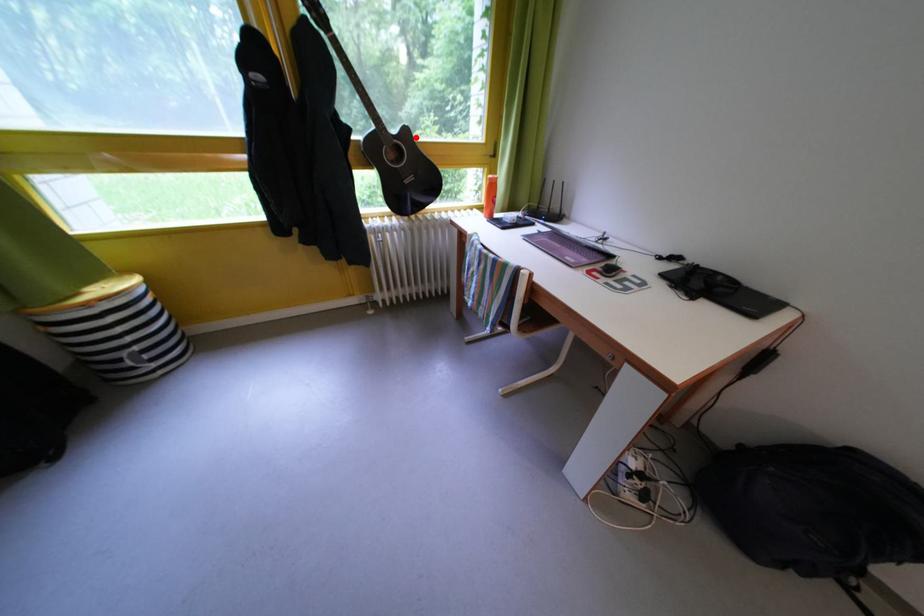
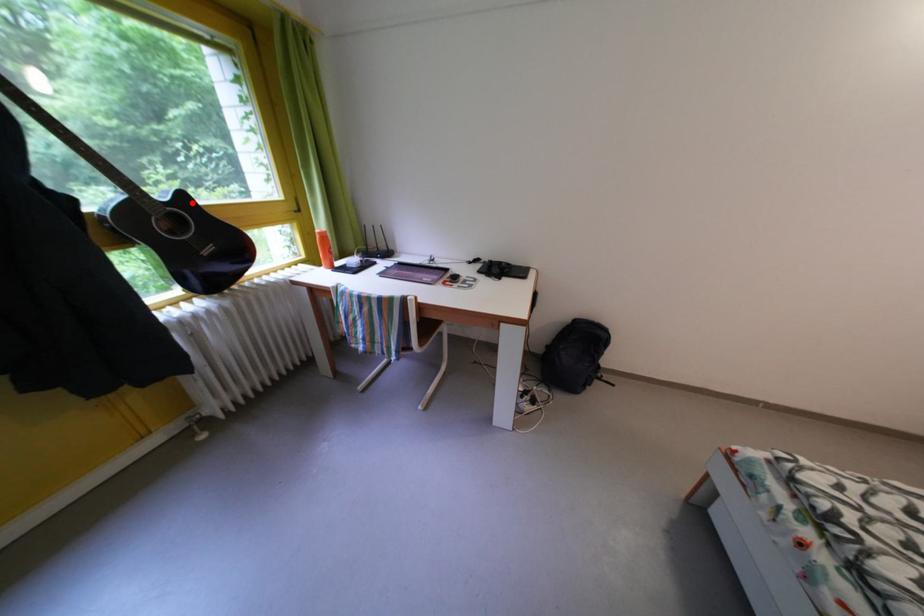
I am providing you with two images of the same scene from different viewpoints. A red point is marked on the first image and another point is marked on the second image. Are the points marked in image1 and image2 representing the same 3D position?

Yes